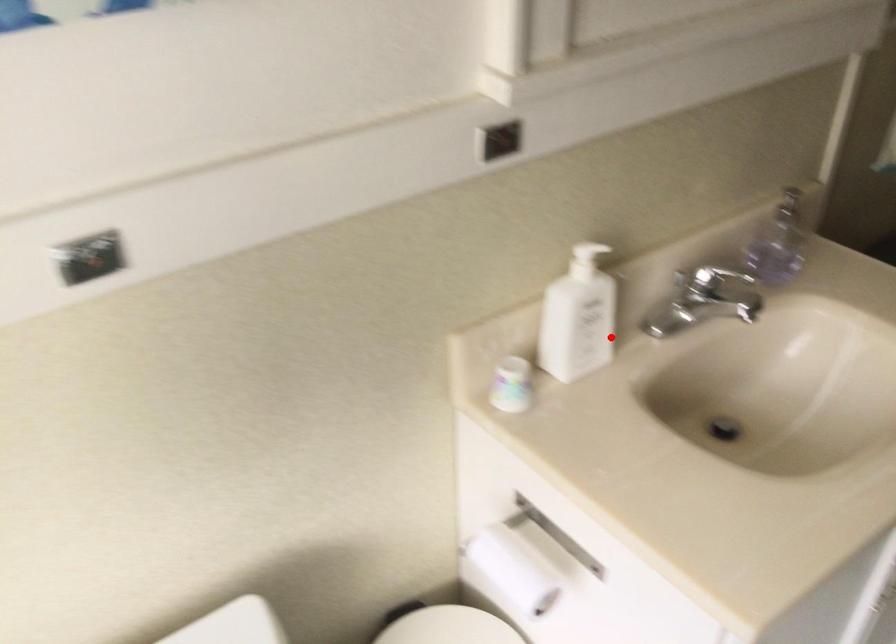
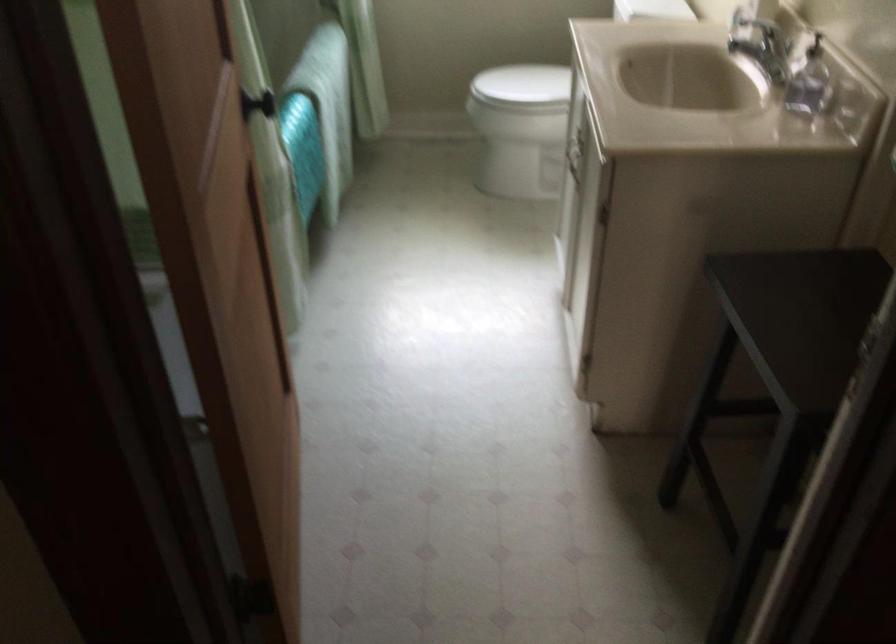
The point at the highlighted location is marked in the first image. Where is the corresponding point in the second image?

(760, 44)